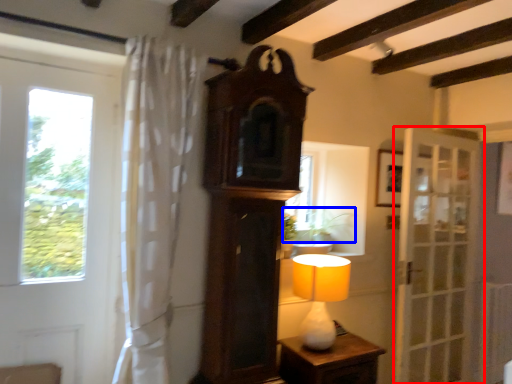
Question: Among these objects, which one is nearest to the camera, door (highlighted by a red box) or plant (highlighted by a blue box)?

Choices:
 (A) door
 (B) plant

Answer: (B)